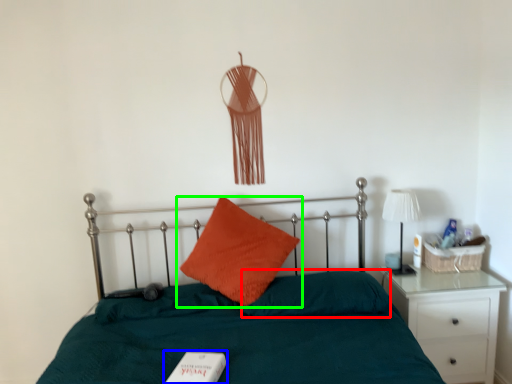
Question: Based on their relative distances, which object is nearer to pillow (highlighted by a red box)? Choose from book (highlighted by a blue box) and pillow (highlighted by a green box).

Choices:
 (A) book
 (B) pillow

Answer: (B)